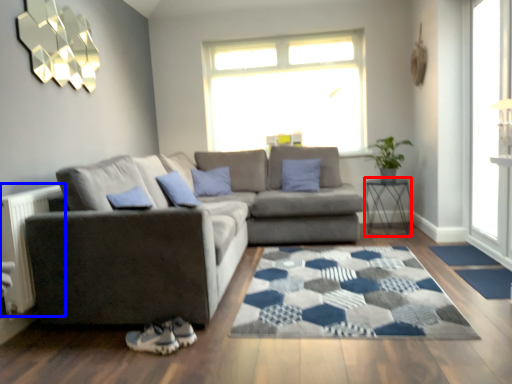
Question: Which object is further to the camera taking this photo, table (highlighted by a red box) or radiator (highlighted by a blue box)?

Choices:
 (A) table
 (B) radiator

Answer: (A)